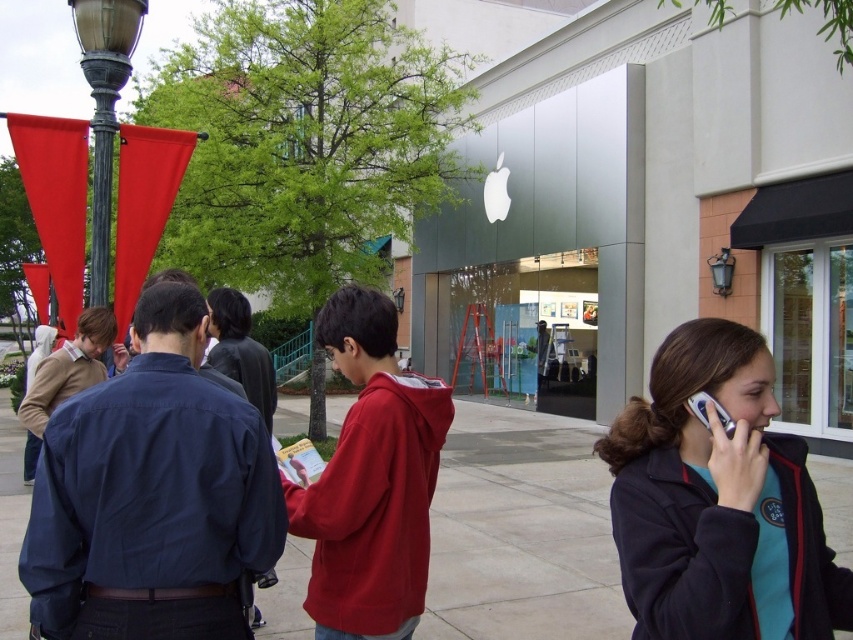
You need to walk from the bronze lamp post at upper left to the smooth concrete pavement at center. Which direction should you move to reach the pavement?

To reach the smooth concrete pavement at center from the bronze lamp post at upper left, you should move towards the center of the image since the pavement is located there.